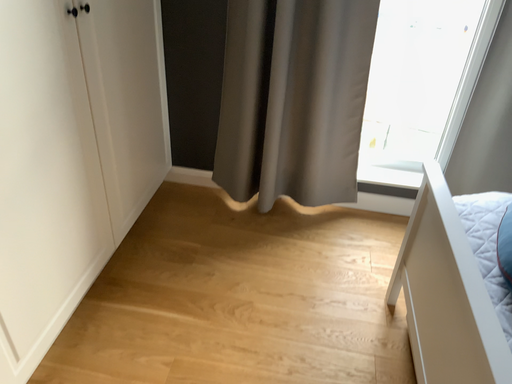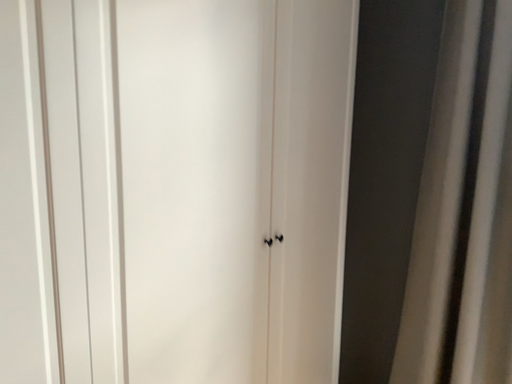
Question: How did the camera likely rotate when shooting the video?

Choices:
 (A) rotated upward
 (B) rotated downward

Answer: (A)